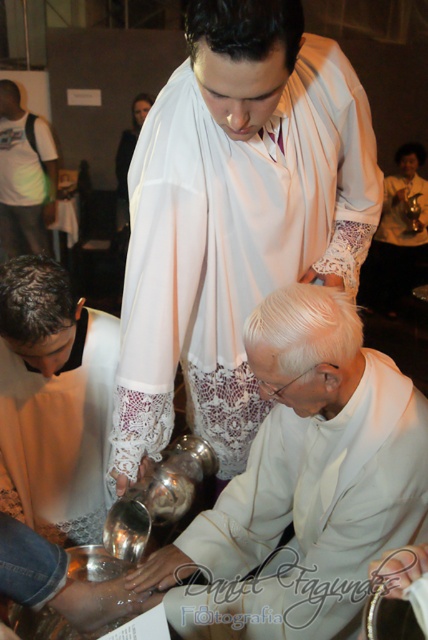
Question: Which is farther from the white lace cloth at center?

Choices:
 (A) white t-shirt at left
 (B) matte white robe at lower left

Answer: (A)

Question: Can you confirm if white lace cloth at center is smaller than white matte glass at center?

Choices:
 (A) yes
 (B) no

Answer: (B)

Question: Considering the real-world distances, which object is closest to the white matte glass at center?

Choices:
 (A) white t-shirt at left
 (B) matte white robe at lower left
 (C) white lace cloth at center

Answer: (C)

Question: Is white lace cloth at center below matte white robe at lower left?

Choices:
 (A) yes
 (B) no

Answer: (B)

Question: Is white matte glass at center to the left of white t-shirt at left from the viewer's perspective?

Choices:
 (A) no
 (B) yes

Answer: (A)

Question: Which point appears closest to the camera in this image?

Choices:
 (A) (56, 422)
 (B) (3, 102)
 (C) (222, 444)

Answer: (C)